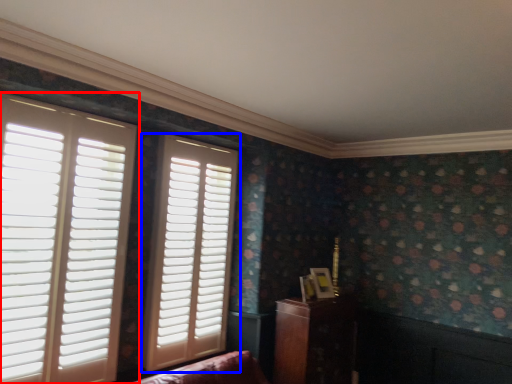
Question: Among these objects, which one is farthest to the camera, window (highlighted by a red box) or window (highlighted by a blue box)?

Choices:
 (A) window
 (B) window

Answer: (B)